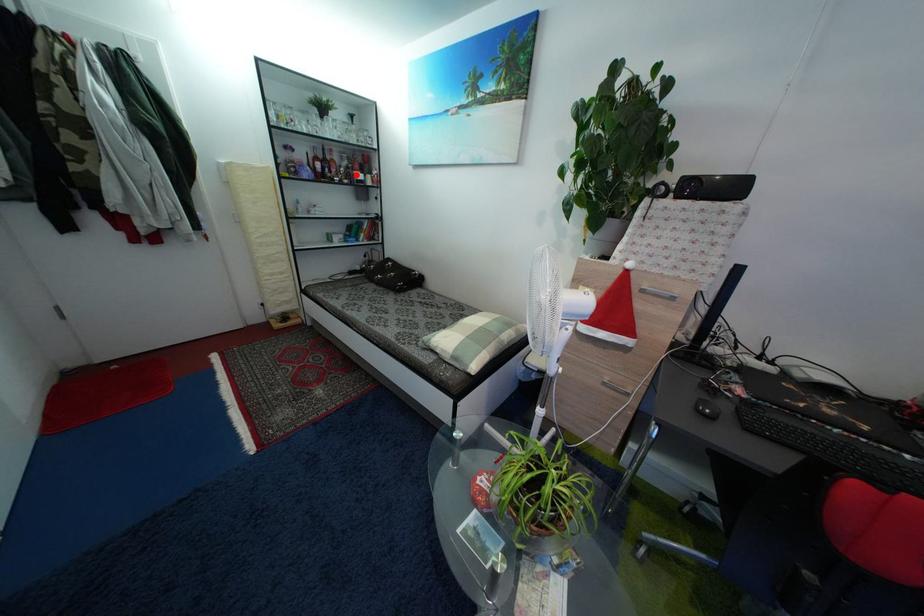
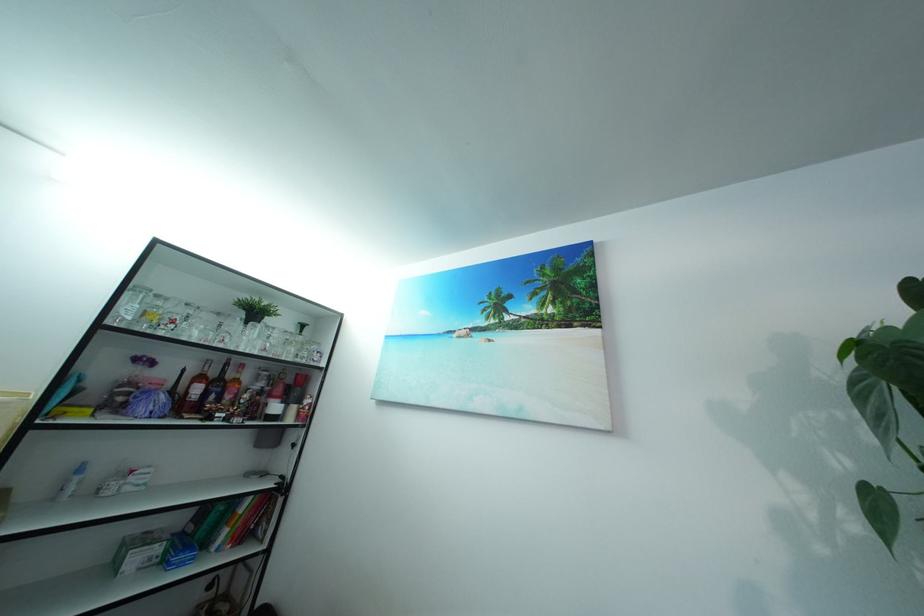
Question: I am providing you with two images of the same scene from different viewpoints. A red point is marked on the first image. At the location where the point appears in image 1, is it still visible in image 2?

Choices:
 (A) Yes
 (B) No

Answer: (A)